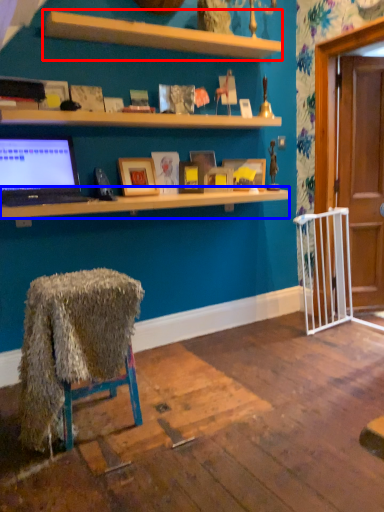
Question: Which object is closer to the camera taking this photo, shelf (highlighted by a red box) or desk (highlighted by a blue box)?

Choices:
 (A) shelf
 (B) desk

Answer: (B)